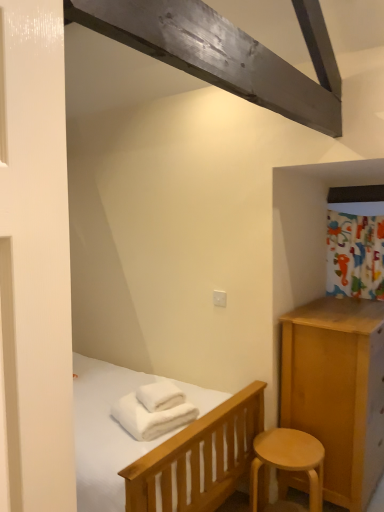
Question: Which direction should I rotate to face white soft bath towel at lower center, the 2th bath towel when ordered from top to bottom, — up or down?

Choices:
 (A) up
 (B) down

Answer: (B)

Question: Is light wood stool at lower right oriented away from white soft towel at center, which appears as the second bath towel when ordered from the bottom?

Choices:
 (A) yes
 (B) no

Answer: (B)

Question: Does light wood stool at lower right appear on the right side of white soft towel at center, arranged as the first bath towel when viewed from the top?

Choices:
 (A) yes
 (B) no

Answer: (A)

Question: From the image's perspective, would you say light wood stool at lower right is shown under white soft towel at center, which appears as the second bath towel when ordered from the bottom?

Choices:
 (A) yes
 (B) no

Answer: (A)

Question: Can you confirm if light wood stool at lower right is wider than white soft towel at center, which appears as the second bath towel when ordered from the bottom?

Choices:
 (A) no
 (B) yes

Answer: (B)

Question: Is white soft towel at center, arranged as the first bath towel when viewed from the top, completely or partially inside light wood stool at lower right?

Choices:
 (A) yes
 (B) no

Answer: (B)

Question: Is light wood stool at lower right smaller than white soft towel at center, arranged as the first bath towel when viewed from the top?

Choices:
 (A) no
 (B) yes

Answer: (A)

Question: Is light wood stool at lower right with white soft bath towel at lower center, acting as the first bath towel starting from the bottom?

Choices:
 (A) yes
 (B) no

Answer: (B)

Question: Could you tell me if light wood stool at lower right is turned towards white soft bath towel at lower center, the 2th bath towel when ordered from top to bottom?

Choices:
 (A) yes
 (B) no

Answer: (B)

Question: Is light wood stool at lower right oriented away from white soft bath towel at lower center, acting as the first bath towel starting from the bottom?

Choices:
 (A) no
 (B) yes

Answer: (A)

Question: Is light wood stool at lower right smaller than white soft bath towel at lower center, the 2th bath towel when ordered from top to bottom?

Choices:
 (A) no
 (B) yes

Answer: (A)

Question: Is light wood stool at lower right bigger than white soft bath towel at lower center, acting as the first bath towel starting from the bottom?

Choices:
 (A) no
 (B) yes

Answer: (B)

Question: From a real-world perspective, does light wood stool at lower right stand above white soft bath towel at lower center, the 2th bath towel when ordered from top to bottom?

Choices:
 (A) yes
 (B) no

Answer: (B)

Question: Can you confirm if white soft bath towel at lower center, the 2th bath towel when ordered from top to bottom, is wider than white soft towel at center, arranged as the first bath towel when viewed from the top?

Choices:
 (A) no
 (B) yes

Answer: (B)